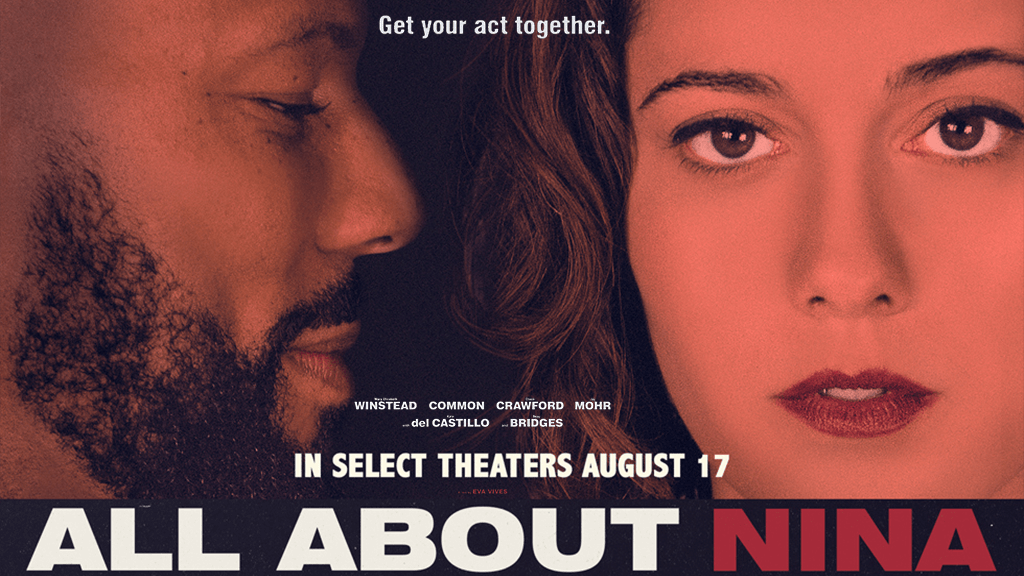
At what (x,y) coordinates should I click in order to perform the action: click on movie poster. Please return your answer as a coordinate pair (x, y). Looking at the image, I should click on (502, 204).